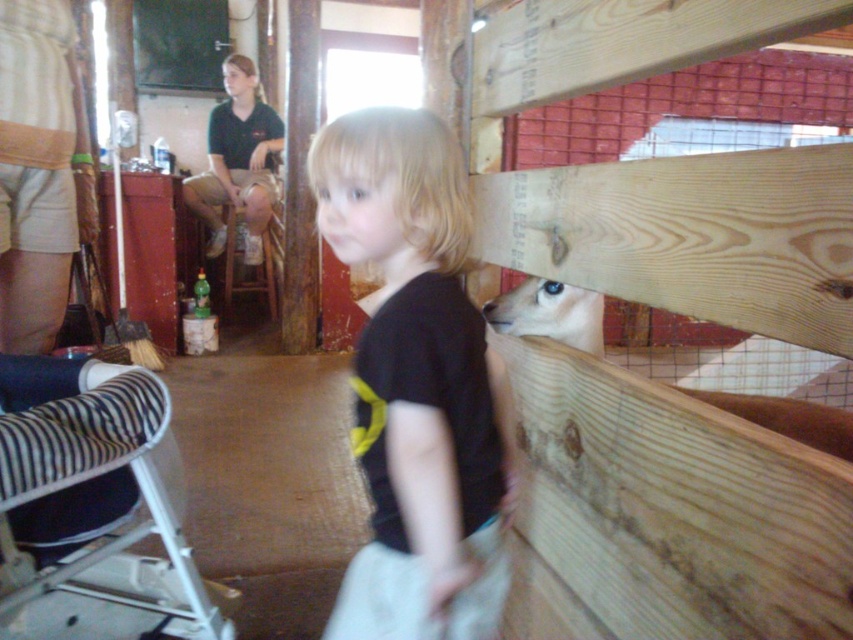
Question: Does black matte shirt at center have a larger size compared to blue glossy antelope at upper right?

Choices:
 (A) yes
 (B) no

Answer: (A)

Question: Where is black matte shirt at center located in relation to blue glossy antelope at upper right in the image?

Choices:
 (A) below
 (B) above

Answer: (A)

Question: Which object is closer to the camera taking this photo?

Choices:
 (A) blue glossy antelope at upper right
 (B) black matte shirt at center

Answer: (B)

Question: Which of the following is the closest to the observer?

Choices:
 (A) black matte shirt at center
 (B) blue glossy antelope at upper right

Answer: (A)

Question: Does black matte shirt at center lie behind blue glossy antelope at upper right?

Choices:
 (A) yes
 (B) no

Answer: (B)